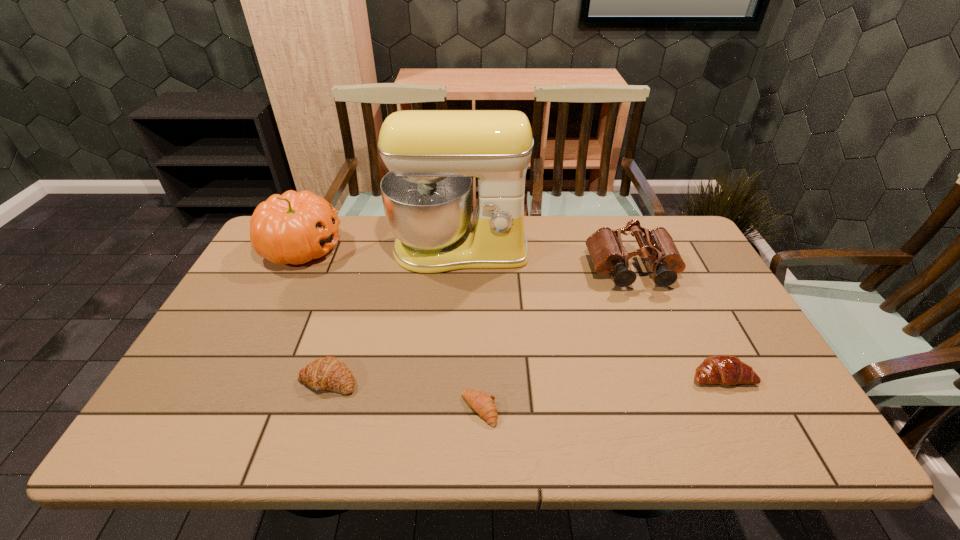
The height and width of the screenshot is (540, 960). I want to click on vacant area that lies between the shortest object and the tallest object, so click(469, 330).

The height and width of the screenshot is (540, 960). Identify the location of empty space that is in between the rightmost crescent roll and the shortest crescent roll. (600, 393).

Find the location of a particular element. This screenshot has width=960, height=540. empty space that is in between the leftmost object and the second crescent roll from right to left is located at coordinates (391, 329).

I want to click on unoccupied area between the fifth object from right to left and the leftmost object, so click(x=315, y=314).

This screenshot has height=540, width=960. Identify the location of vacant area that lies between the shortest object and the fourth shortest object. (556, 340).

Find the location of a particular element. The height and width of the screenshot is (540, 960). free space that is in between the tallest object and the binoculars is located at coordinates (546, 261).

At what (x,y) coordinates should I click in order to perform the action: click on empty space that is in between the tallest object and the rightmost crescent roll. Please return your answer as a coordinate pair (x, y). The height and width of the screenshot is (540, 960). Looking at the image, I should click on (590, 313).

This screenshot has width=960, height=540. What are the coordinates of `the fifth closest object to the second tallest object` in the screenshot? It's located at 720,369.

At what (x,y) coordinates should I click in order to perform the action: click on object that is the second closest one to the rightmost crescent roll. Please return your answer as a coordinate pair (x, y). The height and width of the screenshot is (540, 960). Looking at the image, I should click on (483, 404).

Locate which crescent roll is the third closest to the second tallest object. Please provide its 2D coordinates. Your answer should be formatted as a tuple, i.e. [(x, y)], where the tuple contains the x and y coordinates of a point satisfying the conditions above.

[(720, 369)]